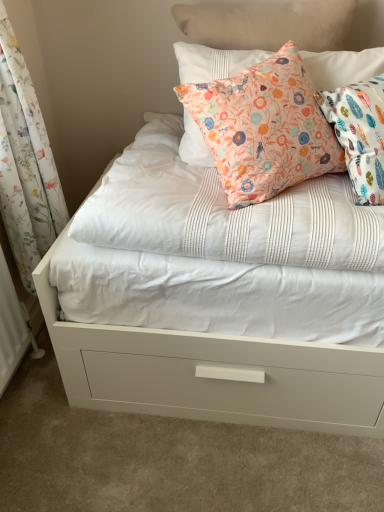
Question: In terms of height, does floral fabric curtain at left look taller or shorter compared to floral fabric pillow at upper center?

Choices:
 (A) tall
 (B) short

Answer: (A)

Question: In terms of width, does floral fabric curtain at left look wider or thinner when compared to floral fabric pillow at upper center?

Choices:
 (A) wide
 (B) thin

Answer: (B)

Question: From a real-world perspective, is floral fabric curtain at left above or below floral fabric pillow at upper center?

Choices:
 (A) below
 (B) above

Answer: (A)

Question: Choose the correct answer: Is floral fabric pillow at upper center inside floral fabric curtain at left or outside it?

Choices:
 (A) outside
 (B) inside

Answer: (A)

Question: Is floral fabric pillow at upper center to the left or to the right of floral fabric curtain at left in the image?

Choices:
 (A) right
 (B) left

Answer: (A)

Question: Is point (238, 155) positioned closer to the camera than point (21, 72)?

Choices:
 (A) closer
 (B) farther

Answer: (A)

Question: From the image's perspective, relative to floral fabric curtain at left, is floral fabric pillow at upper center above or below?

Choices:
 (A) below
 (B) above

Answer: (B)